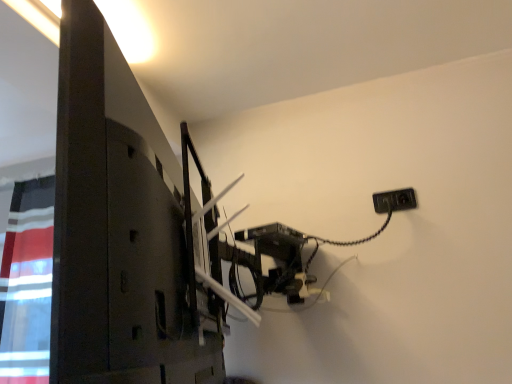
Where is `black plastic power plugs and sockets at upper right`? The height and width of the screenshot is (384, 512). black plastic power plugs and sockets at upper right is located at coordinates (394, 201).

What do you see at coordinates (394, 201) in the screenshot? This screenshot has height=384, width=512. I see `black plastic power plugs and sockets at upper right` at bounding box center [394, 201].

What are the coordinates of `black plastic power plugs and sockets at upper right` in the screenshot? It's located at (394, 201).